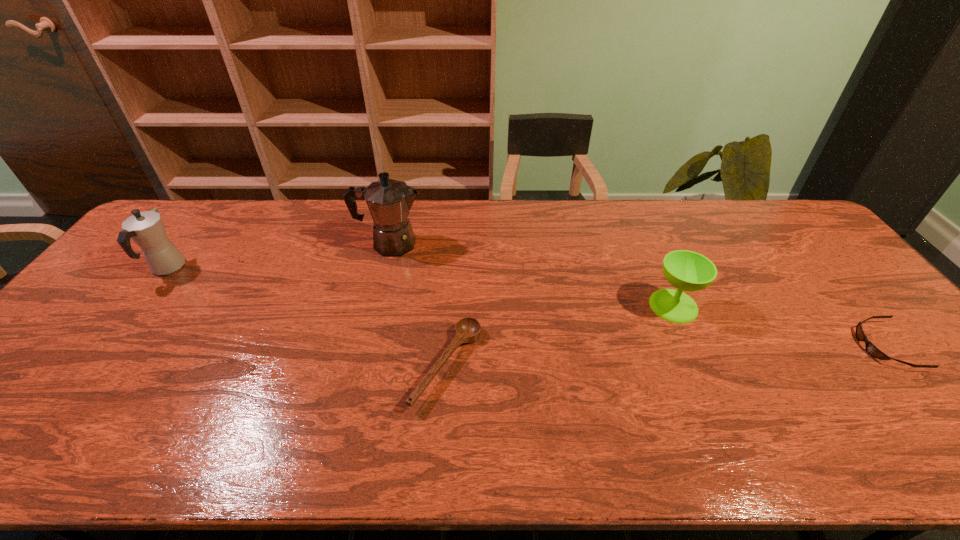
Where is `vacant space at the far edge of the desktop`? This screenshot has height=540, width=960. vacant space at the far edge of the desktop is located at coordinates (602, 211).

You are a GUI agent. You are given a task and a screenshot of the screen. Output one action in this format:
    pyautogui.click(x=<x>, y=<y>)
    Task: Click on the blank space at the near edge of the desktop
    
    Given the screenshot: What is the action you would take?
    pyautogui.click(x=546, y=447)

Where is `vacant space at the left edge`? vacant space at the left edge is located at coordinates (101, 292).

Identify the location of vacant space at the right edge of the desktop. (783, 256).

Locate an element on the screen. vacant area at the far left corner is located at coordinates (177, 217).

Locate an element on the screen. This screenshot has width=960, height=540. vacant position at the near right corner of the desktop is located at coordinates (927, 438).

The height and width of the screenshot is (540, 960). In order to click on unoccupied area between the rightmost object and the third object from right to left in this screenshot , I will do `click(666, 356)`.

Find the location of a particular element. The height and width of the screenshot is (540, 960). empty space between the fourth tallest object and the second tallest object is located at coordinates (307, 316).

Find the location of a particular element. The height and width of the screenshot is (540, 960). free spot between the second object from left to right and the rightmost object is located at coordinates tap(637, 295).

Where is `free area in between the tallest object and the third object from left to right`? This screenshot has height=540, width=960. free area in between the tallest object and the third object from left to right is located at coordinates (419, 305).